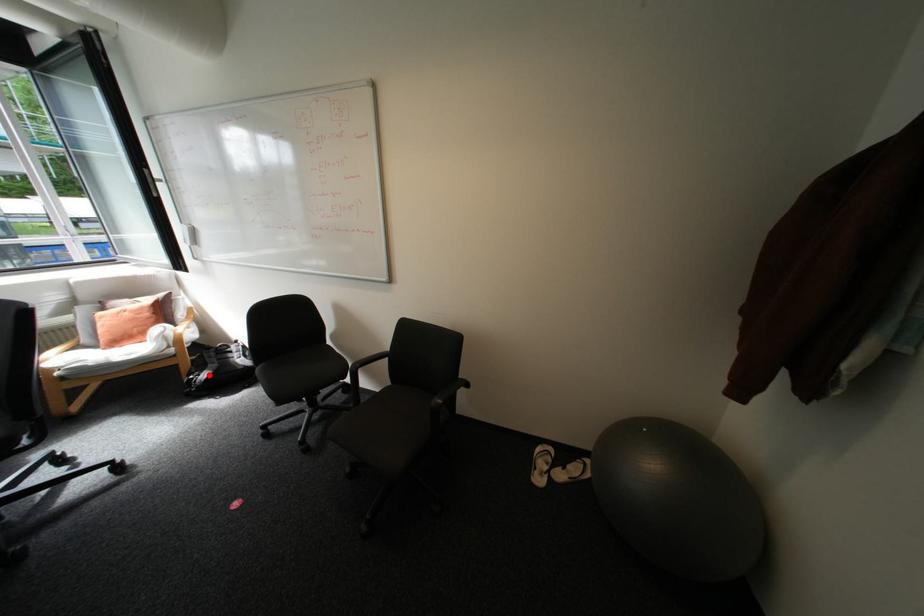
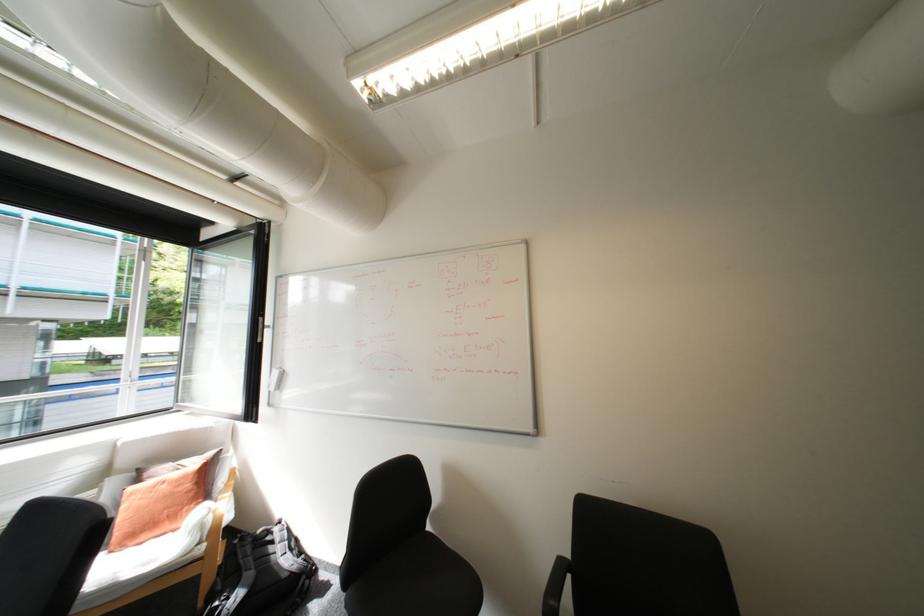
Question: I am providing you with two images of the same scene from different viewpoints. Image1 has a red point marked. In image2, the corresponding 3D location appears at what relative position? Reply with the corresponding letter.

Choices:
 (A) Closer
 (B) Farther

Answer: (A)